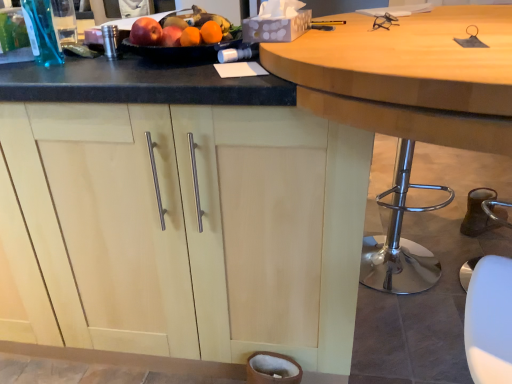
Question: In terms of width, does glossy plastic fruit dish at upper center look wider or thinner when compared to light wood cabinet at center?

Choices:
 (A) thin
 (B) wide

Answer: (A)

Question: Is glossy plastic fruit dish at upper center bigger or smaller than light wood cabinet at center?

Choices:
 (A) small
 (B) big

Answer: (A)

Question: Estimate the real-world distances between objects in this image. Which object is closer to the light wood cabinet at center?

Choices:
 (A) glossy plastic fruit dish at upper center
 (B) wooden table at center

Answer: (A)

Question: Based on their relative distances, which object is farther from the wooden table at center?

Choices:
 (A) glossy plastic fruit dish at upper center
 (B) light wood cabinet at center

Answer: (B)